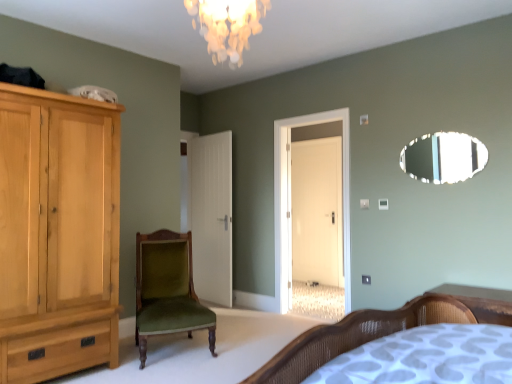
Question: Is green velvet chair at center taller or shorter than white glossy door at center?

Choices:
 (A) short
 (B) tall

Answer: (A)

Question: From a real-world perspective, relative to white glossy door at center, is green velvet chair at center vertically above or below?

Choices:
 (A) below
 (B) above

Answer: (A)

Question: Which of these objects is positioned closest to the light wood cabinet at left?

Choices:
 (A) green velvet chair at center
 (B) oval glass mirror at upper right
 (C) wooden bed at lower right
 (D) iridescent glass chandelier at upper center
 (E) white matte door at center

Answer: (A)

Question: Which of these objects is positioned closest to the iridescent glass chandelier at upper center?

Choices:
 (A) green velvet chair at center
 (B) white glossy door at center
 (C) light wood cabinet at left
 (D) oval glass mirror at upper right
 (E) wooden bed at lower right

Answer: (C)